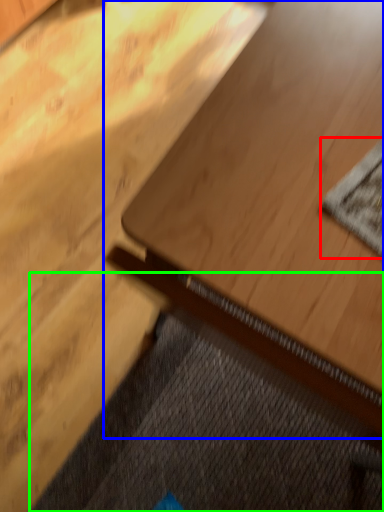
Question: Which object is the farthest from mat (highlighted by a red box)? Choose among these: table (highlighted by a blue box) or doormat (highlighted by a green box).

Choices:
 (A) table
 (B) doormat

Answer: (B)